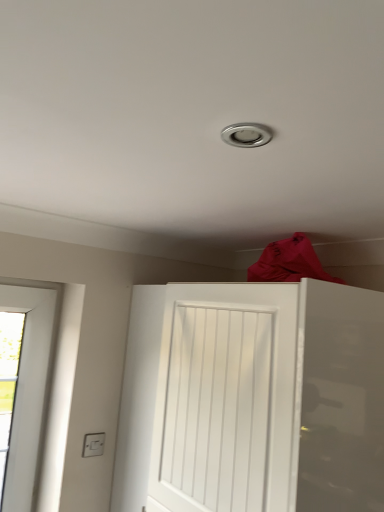
Question: Is white plastic electric outlet at lower left shorter than white matte door at center?

Choices:
 (A) no
 (B) yes

Answer: (B)

Question: Does white plastic electric outlet at lower left appear on the left side of white matte door at center?

Choices:
 (A) no
 (B) yes

Answer: (B)

Question: From a real-world perspective, does white plastic electric outlet at lower left stand above white matte door at center?

Choices:
 (A) no
 (B) yes

Answer: (A)

Question: Are white plastic electric outlet at lower left and white matte door at center located far from each other?

Choices:
 (A) no
 (B) yes

Answer: (A)

Question: From the image's perspective, would you say white plastic electric outlet at lower left is shown under white matte door at center?

Choices:
 (A) no
 (B) yes

Answer: (B)

Question: Does white plastic electric outlet at lower left have a greater width compared to white matte door at center?

Choices:
 (A) yes
 (B) no

Answer: (B)

Question: From the image's perspective, is white matte door at center below white plastic electric outlet at lower left?

Choices:
 (A) yes
 (B) no

Answer: (B)

Question: Can you confirm if white matte door at center is taller than white plastic electric outlet at lower left?

Choices:
 (A) yes
 (B) no

Answer: (A)

Question: Is white matte door at center facing away from white plastic electric outlet at lower left?

Choices:
 (A) no
 (B) yes

Answer: (A)

Question: Is white matte door at center thinner than white plastic electric outlet at lower left?

Choices:
 (A) yes
 (B) no

Answer: (B)

Question: From the image's perspective, is white matte door at center located above white plastic electric outlet at lower left?

Choices:
 (A) no
 (B) yes

Answer: (B)

Question: Is the position of white matte door at center more distant than that of white plastic electric outlet at lower left?

Choices:
 (A) yes
 (B) no

Answer: (B)

Question: Does point [302, 320] appear closer or farther from the camera than point [97, 436]?

Choices:
 (A) closer
 (B) farther

Answer: (A)